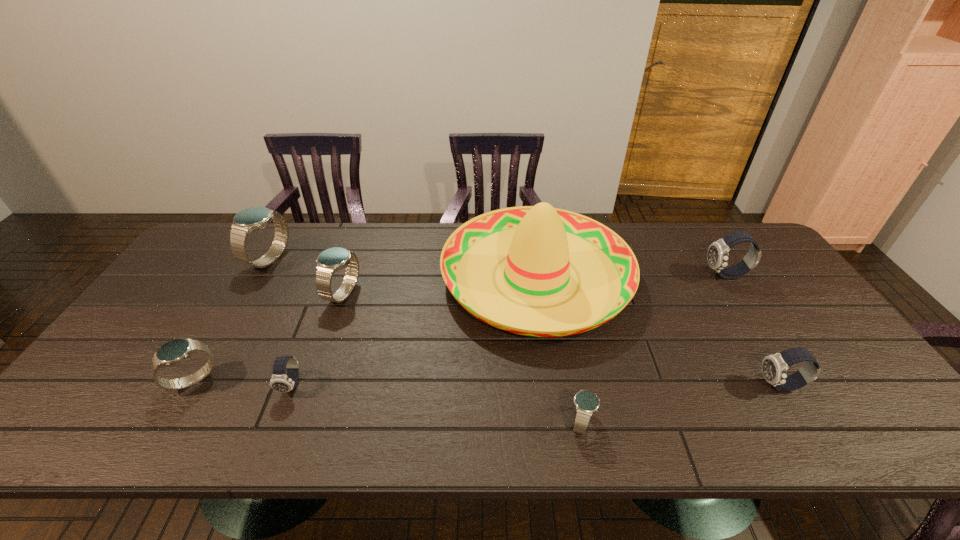
Image resolution: width=960 pixels, height=540 pixels. Identify the location of free space located 0.090m on the face of the smallest dark watch. (273, 434).

Locate an element on the screen. The image size is (960, 540). vacant region located 0.300m on the left of the rightmost blue watch is located at coordinates (433, 422).

Where is `sombrero that is positioned at the far edge`? The width and height of the screenshot is (960, 540). sombrero that is positioned at the far edge is located at coordinates [541, 243].

You are a GUI agent. You are given a task and a screenshot of the screen. Output one action in this format:
    pyautogui.click(x=<x>, y=<y>)
    Task: Click on the object located at the near edge
    
    Given the screenshot: What is the action you would take?
    pyautogui.click(x=586, y=403)

The width and height of the screenshot is (960, 540). I want to click on object located in the right edge section of the desktop, so click(717, 256).

Locate an element on the screen. This screenshot has height=540, width=960. object at the far right corner is located at coordinates (717, 256).

In the image, there is a desktop. Identify the location of blank space at the far edge. This screenshot has width=960, height=540. (674, 233).

You are a GUI agent. You are given a task and a screenshot of the screen. Output one action in this format:
    pyautogui.click(x=<x>, y=<y>)
    Task: Click on the vacant space at the near edge of the desktop
    
    Given the screenshot: What is the action you would take?
    pyautogui.click(x=567, y=431)

Find the location of a particular element. free space at the right edge is located at coordinates (740, 278).

You are a GUI agent. You are given a task and a screenshot of the screen. Output one action in this format:
    pyautogui.click(x=<x>, y=<y>)
    Task: Click on the empty location between the third farthest blue watch and the second biggest dark watch
    This screenshot has width=960, height=540.
    Given the screenshot: What is the action you would take?
    pyautogui.click(x=487, y=383)